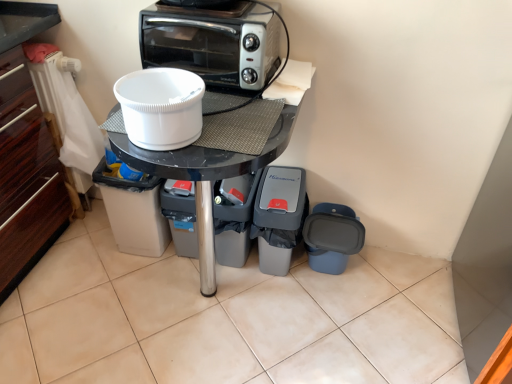
Where is `vacant area situated below blue plastic trash can at lower right, the fifth appliance when ordered from left to right (from a real-world perspective)`? The height and width of the screenshot is (384, 512). vacant area situated below blue plastic trash can at lower right, the fifth appliance when ordered from left to right (from a real-world perspective) is located at coordinates (333, 277).